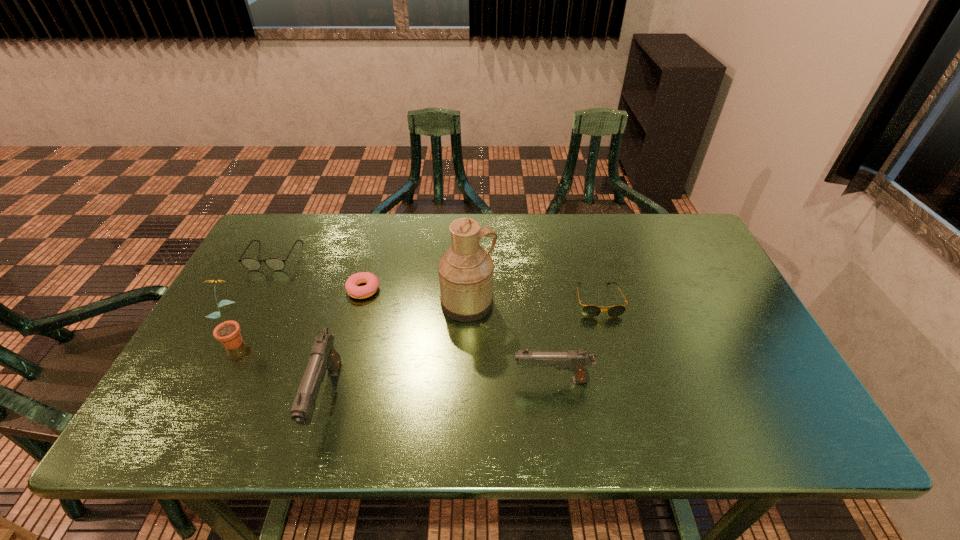
All guns are currently evenly spaced. To continue this pattern, where would you add another gun on the right? Please point out a vacant spot. Please provide its 2D coordinates. Your answer should be formatted as a tuple, i.e. [(x, y)], where the tuple contains the x and y coordinates of a point satisfying the conditions above.

[(761, 363)]